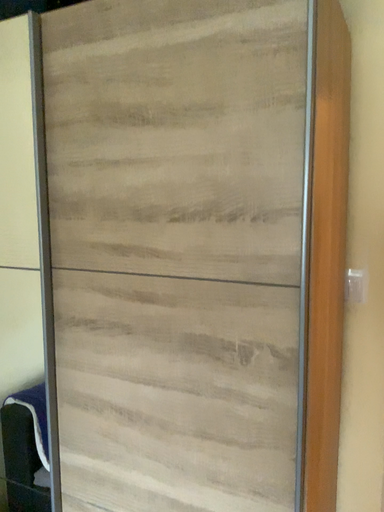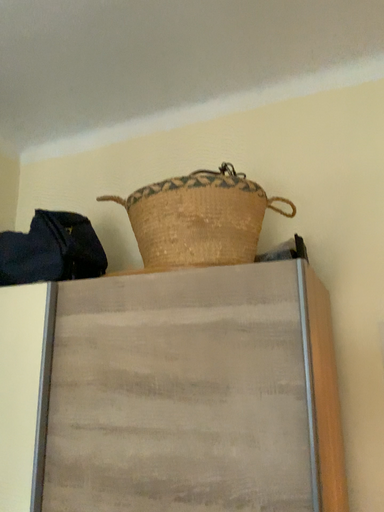
Question: Which way did the camera rotate in the video?

Choices:
 (A) rotated downward
 (B) rotated upward

Answer: (B)